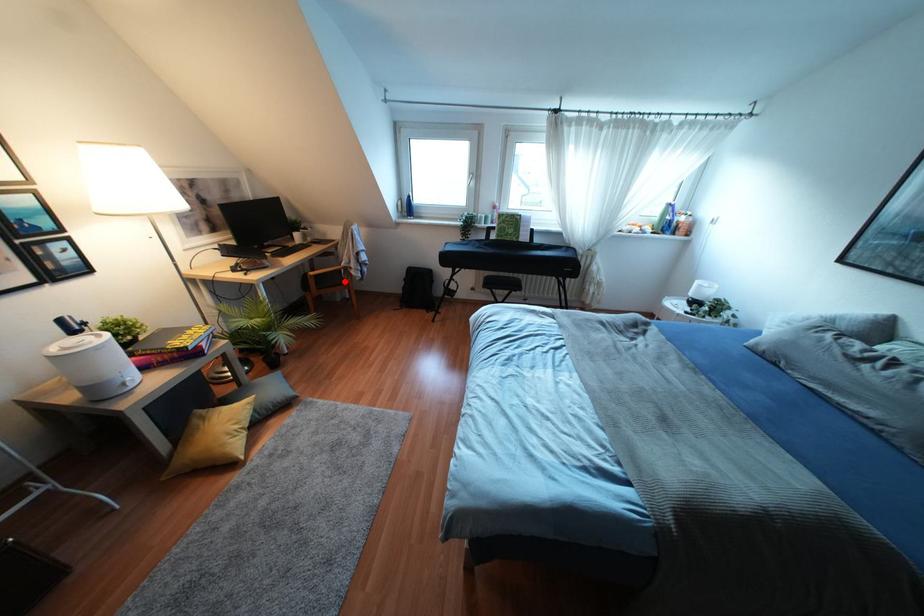
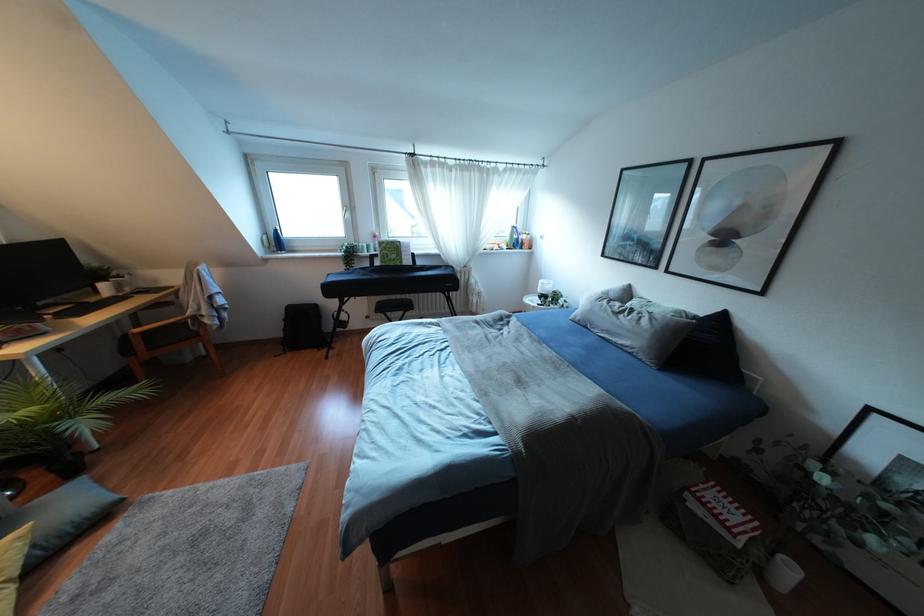
Where in the second image is the point corresponding to the highlighted location from the first image?

(196, 334)